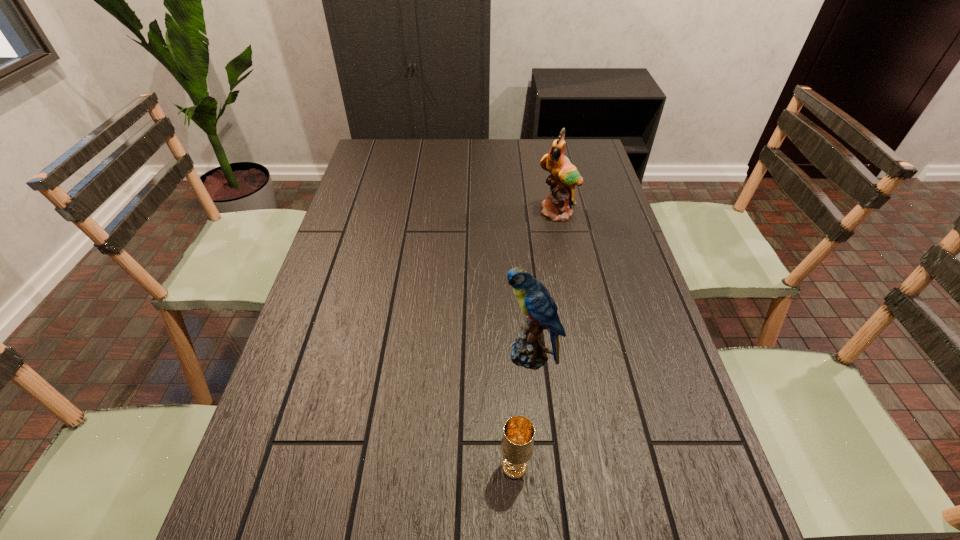
The width and height of the screenshot is (960, 540). I want to click on vacant area located 0.340m on the back of the chalice, so click(x=507, y=320).

This screenshot has height=540, width=960. In order to click on object at the right edge in this screenshot , I will do `click(564, 176)`.

At what (x,y) coordinates should I click in order to perform the action: click on vacant area at the far edge of the desktop. Please return your answer as a coordinate pair (x, y). The image size is (960, 540). Looking at the image, I should click on (418, 153).

Identify the location of blank space at the left edge of the desktop. The height and width of the screenshot is (540, 960). (319, 286).

In the image, there is a desktop. What are the coordinates of `blank space at the right edge` in the screenshot? It's located at point(615,305).

The height and width of the screenshot is (540, 960). In order to click on blank space at the far right corner of the desktop in this screenshot , I will do click(x=577, y=144).

Where is `empty location between the second farthest object and the farthest object`? empty location between the second farthest object and the farthest object is located at coordinates (544, 284).

You are a GUI agent. You are given a task and a screenshot of the screen. Output one action in this format:
    pyautogui.click(x=<x>, y=<y>)
    Task: Click on the free space between the rightmost object and the left parrot
    The height and width of the screenshot is (540, 960).
    Given the screenshot: What is the action you would take?
    pyautogui.click(x=544, y=284)

In order to click on free space that is in between the nearest object and the nearer parrot in this screenshot , I will do `click(522, 410)`.

In order to click on blank region between the right parrot and the left parrot in this screenshot , I will do `click(544, 284)`.